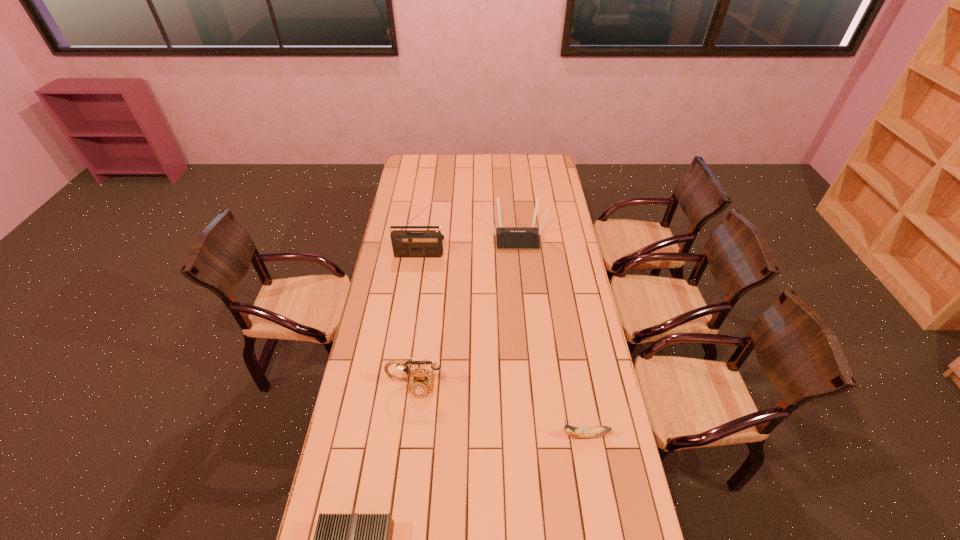
You are a GUI agent. You are given a task and a screenshot of the screen. Output one action in this format:
    pyautogui.click(x=<x>, y=<y>)
    Task: Click on the vacant region between the taller router and the third farthest object
    The image size is (960, 540).
    Given the screenshot: What is the action you would take?
    pyautogui.click(x=466, y=312)

Where is `free space that is in between the third tallest object and the tallest object`? This screenshot has width=960, height=540. free space that is in between the third tallest object and the tallest object is located at coordinates (418, 320).

Where is `empty space between the fourth farthest object and the fourth shortest object`? empty space between the fourth farthest object and the fourth shortest object is located at coordinates (551, 336).

Where is `free space between the radio receiver and the taller router`? This screenshot has width=960, height=540. free space between the radio receiver and the taller router is located at coordinates (469, 246).

The image size is (960, 540). What are the coordinates of `free space between the fourth shortest object and the tallest object` in the screenshot? It's located at (469, 246).

Identify which object is the third nearest to the tallest object. Please provide its 2D coordinates. Your answer should be formatted as a tuple, i.e. [(x, y)], where the tuple contains the x and y coordinates of a point satisfying the conditions above.

[(578, 432)]

Locate an element on the screen. The width and height of the screenshot is (960, 540). object that is the fourth closest to the left router is located at coordinates (507, 237).